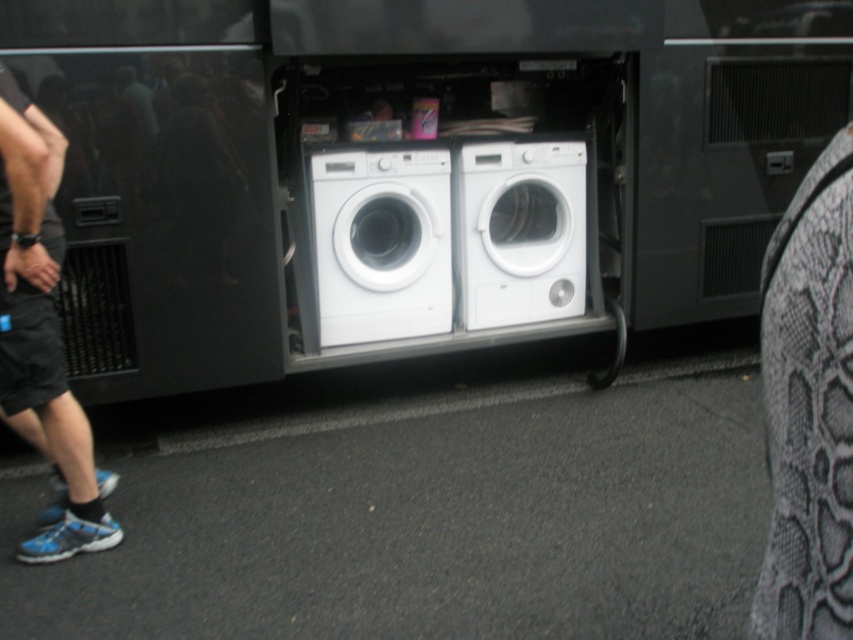
Who is positioned more to the left, white glossy washing machine at center or white plastic washing machine at center?

white glossy washing machine at center is more to the left.

Which is above, white glossy washing machine at center or white plastic washing machine at center?

white plastic washing machine at center

Between point (425, 236) and point (553, 289), which one is positioned in front?

Point (425, 236) is in front.

You are a GUI agent. You are given a task and a screenshot of the screen. Output one action in this format:
    pyautogui.click(x=<x>, y=<y>)
    Task: Click on the white glossy washing machine at center
    
    Given the screenshot: What is the action you would take?
    pyautogui.click(x=381, y=244)

Does blue fabric shorts at lower left have a lesser height compared to white glossy washing machine at center?

Incorrect, blue fabric shorts at lower left's height does not fall short of white glossy washing machine at center's.

Based on the photo, measure the distance from blue fabric shorts at lower left to white glossy washing machine at center.

The distance of blue fabric shorts at lower left from white glossy washing machine at center is 1.12 meters.

Which is behind, point (56, 180) or point (329, 316)?

The point (329, 316) is more distant.

Locate an element on the screen. blue fabric shorts at lower left is located at coordinates (42, 333).

Who is more distant from viewer, (16, 292) or (463, 312)?

The point (463, 312) is more distant.

Is blue fabric shorts at lower left wider than white plastic washing machine at center?

No.

Between point (39, 209) and point (552, 173), which one is positioned in front?

Point (39, 209) is in front.

Identify the location of blue fabric shorts at lower left. (42, 333).